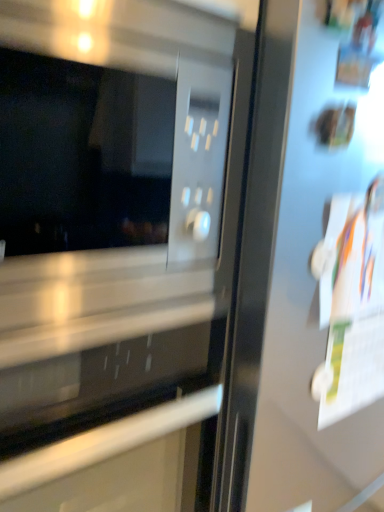
Where is `stainless steel microwave at center`? This screenshot has height=512, width=384. stainless steel microwave at center is located at coordinates (116, 249).

Describe the element at coordinates (116, 249) in the screenshot. I see `stainless steel microwave at center` at that location.

Measure the distance between point (86, 270) and camera.

Point (86, 270) is 20.59 inches away from camera.

What is the approximate width of stainless steel microwave at center?

stainless steel microwave at center is 15.61 centimeters in width.

Locate an element on the screen. The width and height of the screenshot is (384, 512). stainless steel microwave at center is located at coordinates (116, 249).